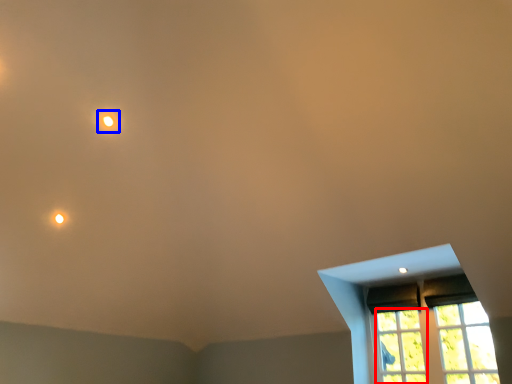
Question: Which of the following is the farthest to the observer, glass window (highlighted by a red box) or light (highlighted by a blue box)?

Choices:
 (A) glass window
 (B) light

Answer: (B)